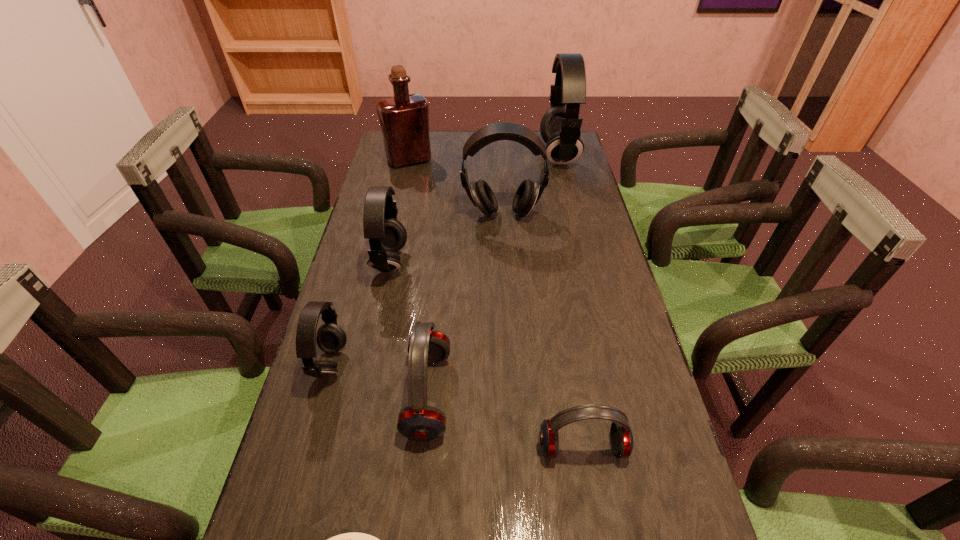
Identify the location of the tallest earphone. (560, 127).

At what (x,y) coordinates should I click in order to perform the action: click on the farthest black earphone. Please return your answer as a coordinate pair (x, y). The height and width of the screenshot is (540, 960). Looking at the image, I should click on (560, 127).

The height and width of the screenshot is (540, 960). Find the location of `brown liquor`. brown liquor is located at coordinates (404, 119).

Where is `the second tallest earphone`? the second tallest earphone is located at coordinates [x=528, y=193].

You are a GUI agent. You are given a task and a screenshot of the screen. Output one action in this format:
    pyautogui.click(x=<x>, y=<y>)
    Task: Click on the second farthest earphone
    The height and width of the screenshot is (540, 960).
    Given the screenshot: What is the action you would take?
    pyautogui.click(x=528, y=193)

I want to click on the fifth nearest object, so click(386, 235).

Identify the location of the third biggest black earphone. This screenshot has width=960, height=540. (386, 235).

Find the location of a particular element. The width and height of the screenshot is (960, 540). the third earphone from left to right is located at coordinates (419, 422).

The width and height of the screenshot is (960, 540). Identify the location of the bigger red earphone. (x=419, y=422).

You are a GUI agent. You are given a task and a screenshot of the screen. Output one action in this format:
    pyautogui.click(x=<x>, y=<y>)
    Task: Click on the smallest black earphone
    
    Given the screenshot: What is the action you would take?
    pyautogui.click(x=331, y=338)